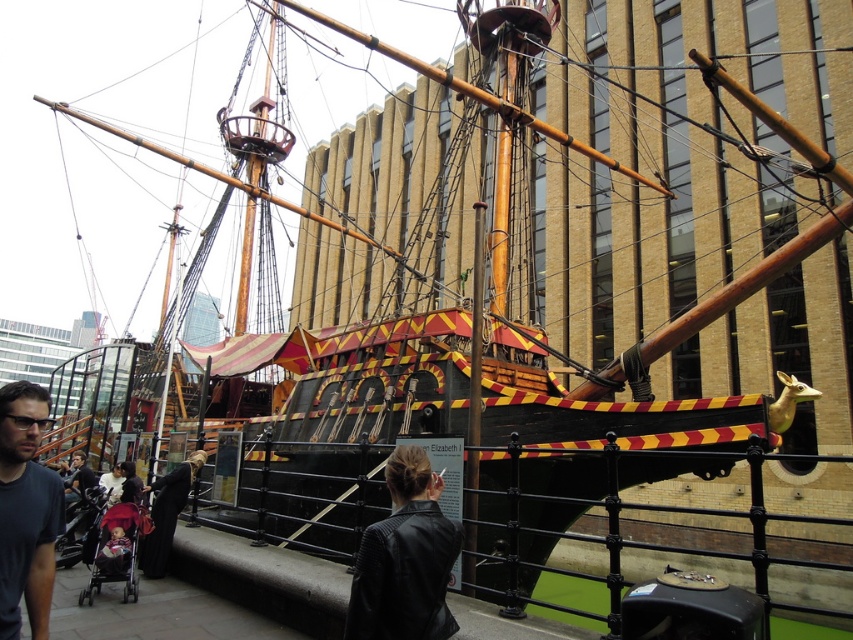
You are standing at the dock near the historical ship. You see a point marked at coordinates [405,557]. Which object is located at that point?

The point at coordinates [405,557] is located on the black leather jacket at center.